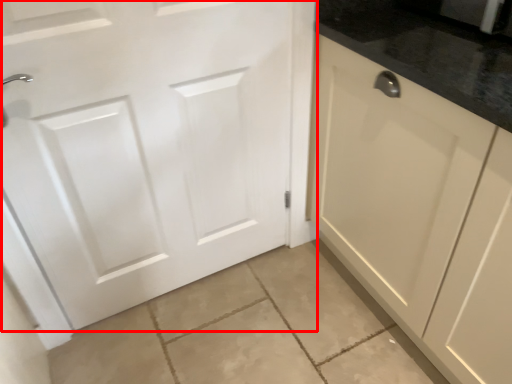
Question: Observing the image, what is the correct spatial positioning of door (annotated by the red box) in reference to cabinetry?

Choices:
 (A) left
 (B) right

Answer: (A)